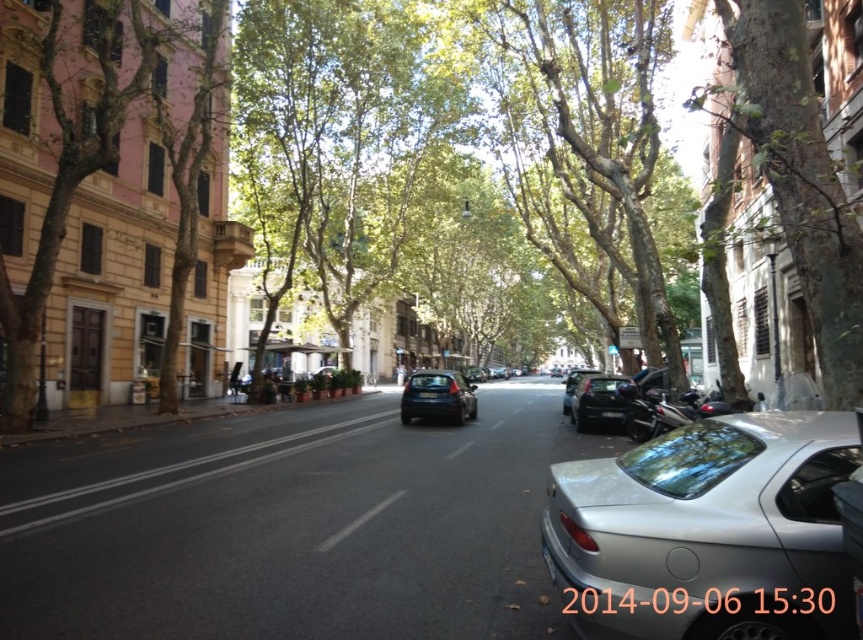
Measure the distance between point (120,483) and camera.

Point (120,483) is 9.31 meters from camera.

Who is positioned more to the left, black asphalt road at center or shiny black car at center?

black asphalt road at center

Does point (87, 506) come closer to viewer compared to point (565, 404)?

Yes.

Where is `black asphalt road at center`? The height and width of the screenshot is (640, 863). black asphalt road at center is located at coordinates (169, 476).

How far apart are silver metallic car at center and glossy black car at center?

silver metallic car at center and glossy black car at center are 12.50 meters apart from each other.

At what (x,y) coordinates should I click in order to perform the action: click on silver metallic car at center. Please return your answer as a coordinate pair (x, y). This screenshot has width=863, height=640. Looking at the image, I should click on (707, 531).

Locate an element on the screen. The height and width of the screenshot is (640, 863). silver metallic car at center is located at coordinates (707, 531).

Can you confirm if black asphalt road at center is bigger than glossy black car at center?

Yes, black asphalt road at center is bigger than glossy black car at center.

How far apart are black asphalt road at center and glossy black car at center?

black asphalt road at center and glossy black car at center are 24.01 feet apart from each other.

This screenshot has height=640, width=863. What are the coordinates of `black asphalt road at center` in the screenshot? It's located at (169, 476).